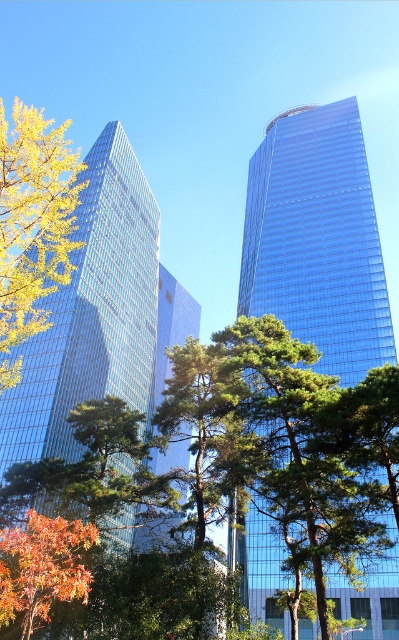
Question: Which point is closer to the camera taking this photo?

Choices:
 (A) (86, 572)
 (B) (254, 316)

Answer: (A)

Question: Considering the real-world distances, which object is closest to the green textured tree at center?

Choices:
 (A) yellow leafy tree at left
 (B) green leafy tree at center

Answer: (B)

Question: Can you confirm if green textured tree at center is positioned to the right of orange leafy tree at lower left?

Choices:
 (A) yes
 (B) no

Answer: (B)

Question: Can you confirm if yellow leafy tree at left is positioned above blue glass building at center?

Choices:
 (A) no
 (B) yes

Answer: (B)

Question: Which of these objects is positioned closest to the orange leafy tree at lower left?

Choices:
 (A) yellow leafy tree at left
 (B) green leafy tree at center
 (C) blue glass building at center
 (D) green textured tree at center

Answer: (B)

Question: Is green leafy tree at center further to the viewer compared to blue glassy skyscraper at center?

Choices:
 (A) yes
 (B) no

Answer: (B)